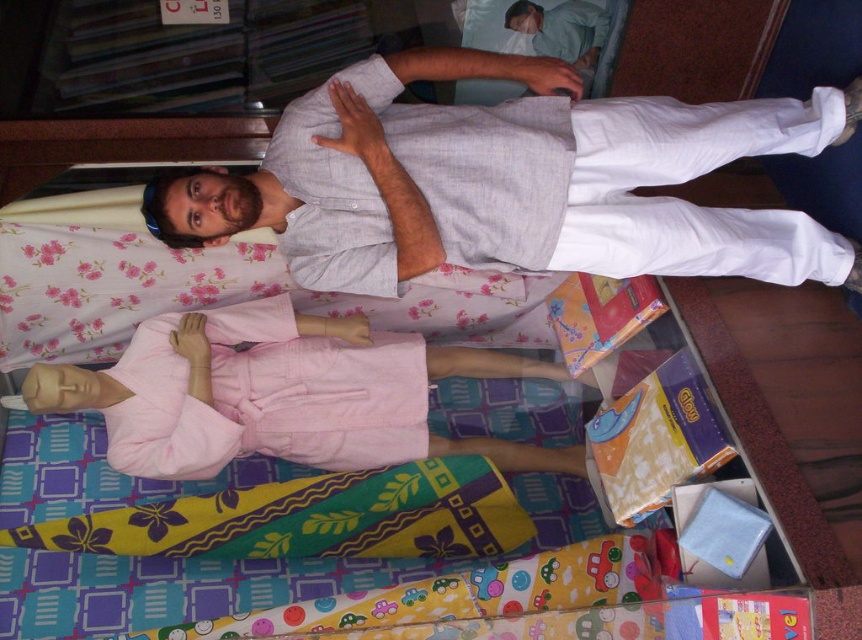
Can you confirm if light gray cotton shirt at center is smaller than pink cotton robe at lower left?

Yes, light gray cotton shirt at center is smaller than pink cotton robe at lower left.

Which is in front, point (494, 122) or point (236, 417)?

Point (494, 122) is in front.

In order to click on light gray cotton shirt at center in this screenshot , I will do `click(510, 180)`.

Is pink cotton robe at lower left positioned before light blue cotton shirt at upper center?

Yes.

Who is taller, pink cotton robe at lower left or light blue cotton shirt at upper center?

Standing taller between the two is pink cotton robe at lower left.

Find the location of a particular element. This screenshot has width=862, height=640. pink cotton robe at lower left is located at coordinates (280, 394).

Does light gray cotton shirt at center have a lesser width compared to light blue cotton shirt at upper center?

Incorrect, light gray cotton shirt at center's width is not less than light blue cotton shirt at upper center's.

Is light gray cotton shirt at center taller than light blue cotton shirt at upper center?

Correct, light gray cotton shirt at center is much taller as light blue cotton shirt at upper center.

Is point (478, 131) less distant than point (536, 16)?

Yes, it is.

This screenshot has height=640, width=862. I want to click on light gray cotton shirt at center, so click(510, 180).